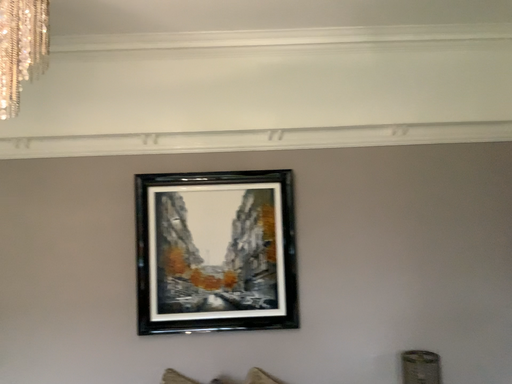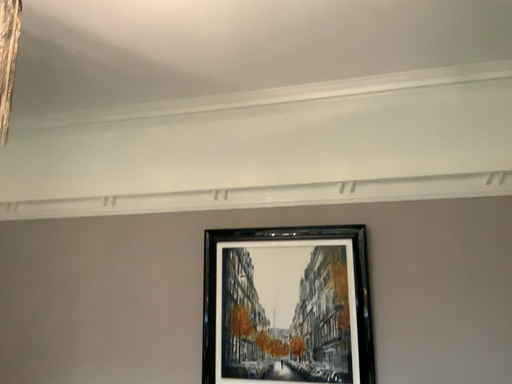
Question: Which way did the camera rotate in the video?

Choices:
 (A) rotated left
 (B) rotated right

Answer: (A)